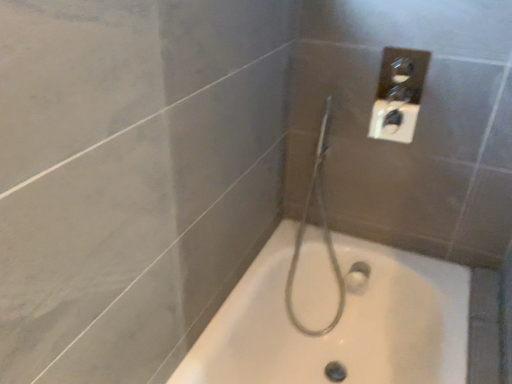
Question: Should I look upward or downward to see silver metallic shower head at center?

Choices:
 (A) down
 (B) up

Answer: (A)

Question: From a real-world perspective, does silver metallic shower head at center sit lower than white glossy bathtub at center?

Choices:
 (A) yes
 (B) no

Answer: (B)

Question: Considering the relative positions of silver metallic shower head at center and white glossy bathtub at center in the image provided, is silver metallic shower head at center to the right of white glossy bathtub at center from the viewer's perspective?

Choices:
 (A) yes
 (B) no

Answer: (B)

Question: Is silver metallic shower head at center behind white glossy bathtub at center?

Choices:
 (A) no
 (B) yes

Answer: (B)

Question: Does silver metallic shower head at center have a lesser width compared to white glossy bathtub at center?

Choices:
 (A) no
 (B) yes

Answer: (B)

Question: Is silver metallic shower head at center shorter than white glossy bathtub at center?

Choices:
 (A) yes
 (B) no

Answer: (B)

Question: Is silver metallic shower head at center facing away from white glossy bathtub at center?

Choices:
 (A) no
 (B) yes

Answer: (A)

Question: Can you confirm if white glossy bathtub at center is taller than silver metallic shower head at center?

Choices:
 (A) no
 (B) yes

Answer: (A)

Question: From the image's perspective, is white glossy bathtub at center over silver metallic shower head at center?

Choices:
 (A) no
 (B) yes

Answer: (A)

Question: From a real-world perspective, is white glossy bathtub at center located beneath silver metallic shower head at center?

Choices:
 (A) no
 (B) yes

Answer: (B)

Question: Can we say white glossy bathtub at center lies outside silver metallic shower head at center?

Choices:
 (A) yes
 (B) no

Answer: (A)

Question: Can you confirm if white glossy bathtub at center is smaller than silver metallic shower head at center?

Choices:
 (A) yes
 (B) no

Answer: (B)

Question: Is silver metallic shower head at center inside white glossy bathtub at center?

Choices:
 (A) no
 (B) yes

Answer: (B)

Question: From a real-world perspective, is white glossy bathtub at center physically located above or below silver metallic shower head at center?

Choices:
 (A) above
 (B) below

Answer: (B)